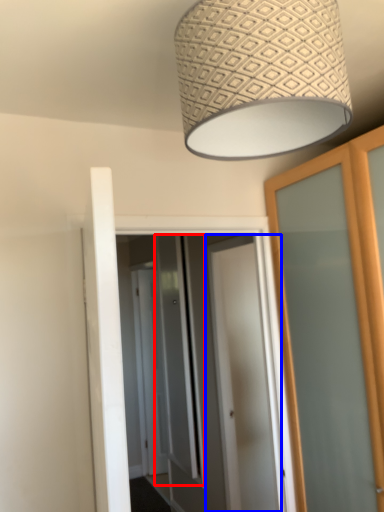
Question: Which object is closer to the camera taking this photo, screen door (highlighted by a red box) or door (highlighted by a blue box)?

Choices:
 (A) screen door
 (B) door

Answer: (B)